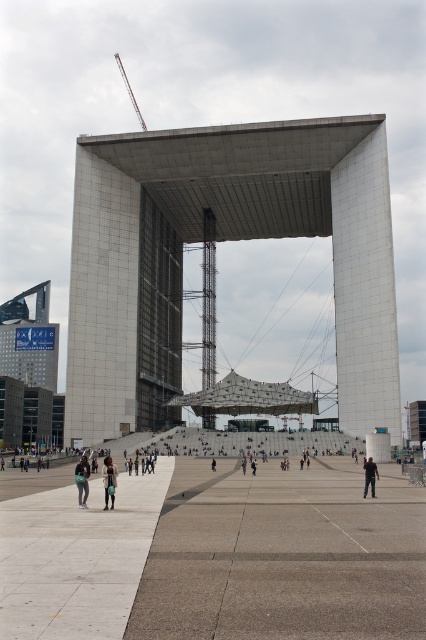
You are standing at the entrance of the modern architectural structure and want to reach the white concrete structure at center and the concrete at center. Which one is closer to you?

Both the white concrete structure at center and the concrete at center are at the same distance of 51.95 meters from you, so neither is closer.

You are an architect observing the scene. You need to determine the spatial relationship between the white concrete structure at center and the concrete at center. Which one is closer to you?

The white concrete structure at center is closer to you because the concrete at center is behind it.

You are standing at the entrance of the modern architectural structure and want to place a new decorative sculpture exactly at the center of the concrete at center. According to the coordinates provided, where should you position the sculpture?

The sculpture should be placed at the coordinates point (253, 548) where the concrete at center is located.